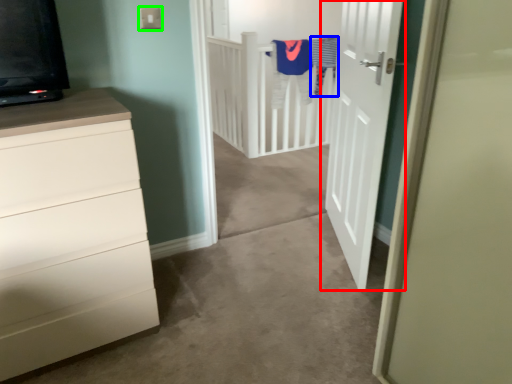
Question: Based on their relative distances, which object is farther from door (highlighted by a red box)? Choose from laundry (highlighted by a blue box) and electric outlet (highlighted by a green box).

Choices:
 (A) laundry
 (B) electric outlet

Answer: (A)